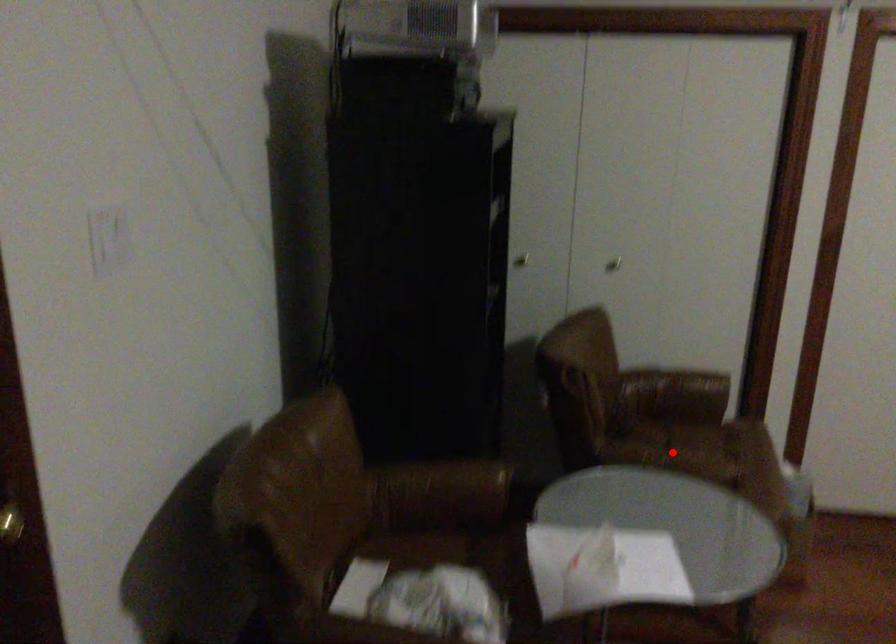
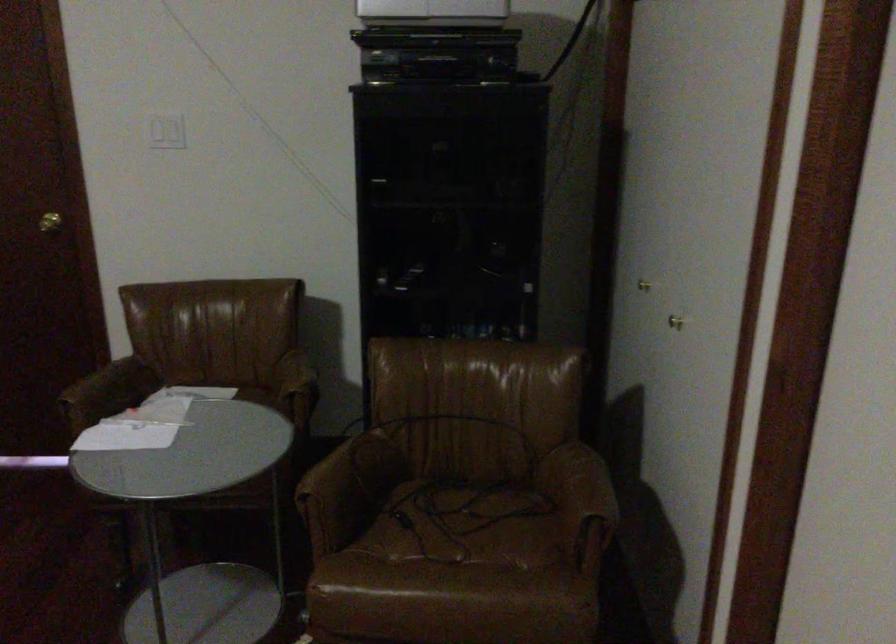
Question: I am providing you with two images of the same scene from different viewpoints. Image1 has a red point marked. In image2, the corresponding 3D location appears at what relative position? Reply with the corresponding letter.

Choices:
 (A) Closer
 (B) Farther

Answer: (A)